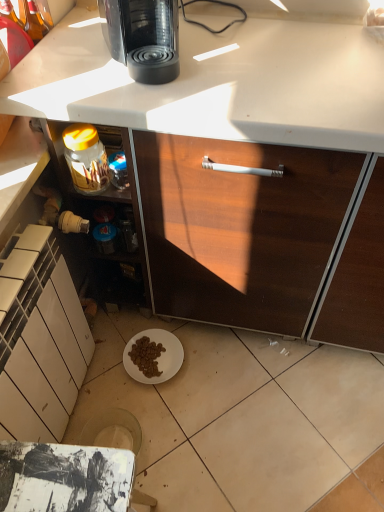
Question: Does white matte cabinet at lower left have a greater width compared to translucent glass jar at lower left?

Choices:
 (A) no
 (B) yes

Answer: (B)

Question: Is the position of white matte cabinet at lower left less distant than that of translucent glass jar at lower left?

Choices:
 (A) yes
 (B) no

Answer: (A)

Question: Is white matte cabinet at lower left turned away from translucent glass jar at lower left?

Choices:
 (A) no
 (B) yes

Answer: (A)

Question: Is white matte cabinet at lower left not within translucent glass jar at lower left?

Choices:
 (A) no
 (B) yes

Answer: (B)

Question: Considering the relative positions of white matte cabinet at lower left and translucent glass jar at lower left in the image provided, is white matte cabinet at lower left behind translucent glass jar at lower left?

Choices:
 (A) no
 (B) yes

Answer: (A)

Question: Do you think translucent glass jar at lower left is within black glossy coffee maker at upper center, or outside of it?

Choices:
 (A) outside
 (B) inside

Answer: (A)

Question: Considering the positions of translucent glass jar at lower left and black glossy coffee maker at upper center in the image, is translucent glass jar at lower left bigger or smaller than black glossy coffee maker at upper center?

Choices:
 (A) small
 (B) big

Answer: (A)

Question: Relative to black glossy coffee maker at upper center, is translucent glass jar at lower left in front or behind?

Choices:
 (A) front
 (B) behind

Answer: (B)

Question: Does point (125, 195) appear closer or farther from the camera than point (153, 11)?

Choices:
 (A) farther
 (B) closer

Answer: (A)

Question: Do you think black glossy coffee maker at upper center is within translucent glass jar at lower left, or outside of it?

Choices:
 (A) inside
 (B) outside

Answer: (B)

Question: From a real-world perspective, is black glossy coffee maker at upper center positioned above or below translucent glass jar at lower left?

Choices:
 (A) below
 (B) above

Answer: (B)

Question: Is point (125, 48) closer or farther from the camera than point (49, 148)?

Choices:
 (A) farther
 (B) closer

Answer: (B)

Question: Considering the positions of black glossy coffee maker at upper center and translucent glass jar at lower left in the image, is black glossy coffee maker at upper center taller or shorter than translucent glass jar at lower left?

Choices:
 (A) tall
 (B) short

Answer: (B)

Question: Is black glossy coffee maker at upper center in front of or behind white matte cabinet at lower left in the image?

Choices:
 (A) front
 (B) behind

Answer: (B)

Question: Based on their positions, is black glossy coffee maker at upper center located to the left or right of white matte cabinet at lower left?

Choices:
 (A) left
 (B) right

Answer: (B)